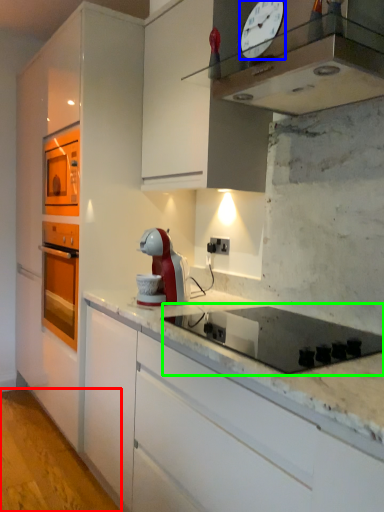
Question: Which object is positioned farthest from concrete (highlighted by a red box)? Select from clock (highlighted by a blue box) and gas stove (highlighted by a green box).

Choices:
 (A) clock
 (B) gas stove

Answer: (A)